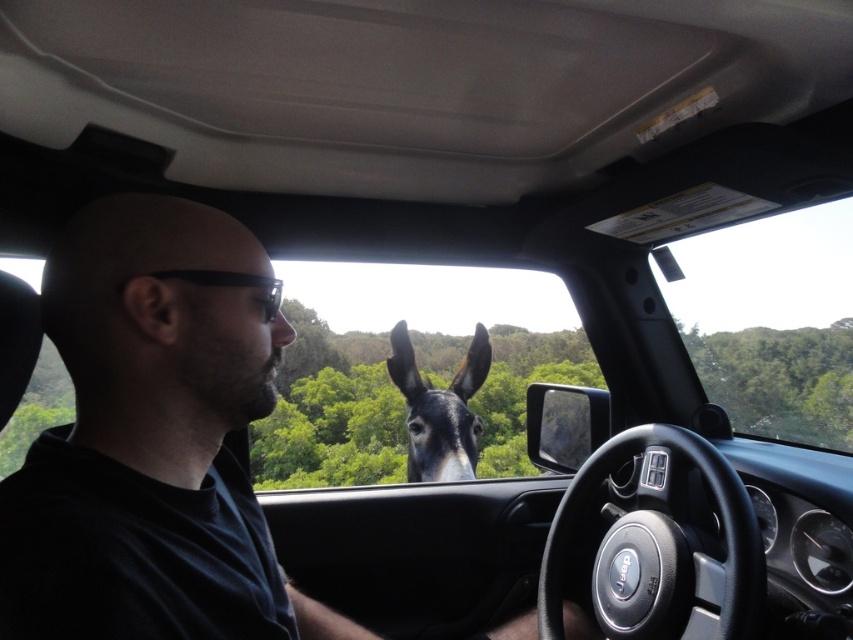
Consider the image. Is black glossy donkey at center positioned behind black plastic glasses at left?

Yes.

Between black glossy donkey at center and black plastic glasses at left, which one appears on the left side from the viewer's perspective?

From the viewer's perspective, black plastic glasses at left appears more on the left side.

Does point (463, 456) lie behind point (161, 275)?

Yes, point (463, 456) is behind point (161, 275).

Locate an element on the screen. This screenshot has height=640, width=853. black glossy donkey at center is located at coordinates (439, 410).

Does black matte shirt at center appear on the right side of black glossy donkey at center?

No, black matte shirt at center is not to the right of black glossy donkey at center.

At what (x,y) coordinates should I click in order to perform the action: click on black matte shirt at center. Please return your answer as a coordinate pair (x, y). Image resolution: width=853 pixels, height=640 pixels. Looking at the image, I should click on (151, 442).

Can you confirm if black matte shirt at center is taller than black plastic glasses at left?

Yes, black matte shirt at center is taller than black plastic glasses at left.

Can you confirm if black matte shirt at center is shorter than black plastic glasses at left?

In fact, black matte shirt at center may be taller than black plastic glasses at left.

I want to click on black matte shirt at center, so click(151, 442).

Find the location of a particular element. black matte shirt at center is located at coordinates (151, 442).